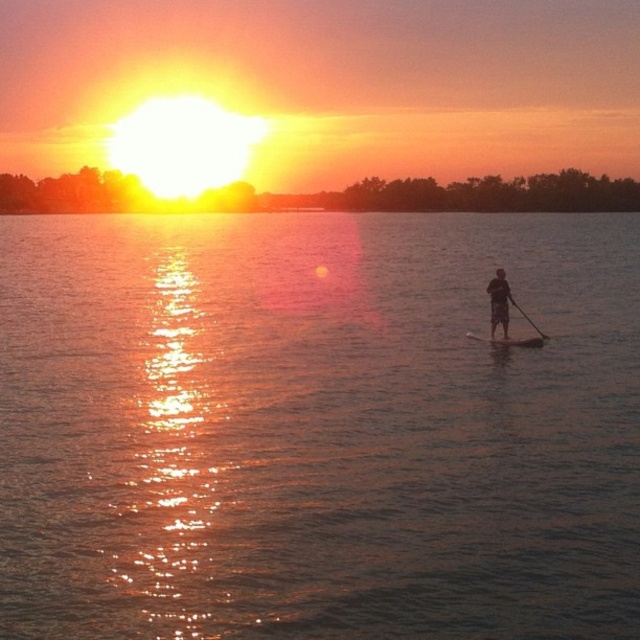
Does glistening water at center have a lesser height compared to dark gray fabric paddleboard at right?

No.

Image resolution: width=640 pixels, height=640 pixels. Find the location of `glistening water at center`. glistening water at center is located at coordinates (316, 428).

Who is more forward, (3, 282) or (493, 320)?

Point (493, 320) is more forward.

What are the coordinates of `glistening water at center` in the screenshot? It's located at (316, 428).

Between point (493, 324) and point (508, 298), which one is positioned behind?

The point (493, 324) is more distant.

Can you confirm if dark gray fabric paddleboard at right is bigger than black smooth paddle at right?

No, dark gray fabric paddleboard at right is not bigger than black smooth paddle at right.

Is point (497, 273) less distant than point (515, 301)?

Yes.

This screenshot has width=640, height=640. I want to click on dark gray fabric paddleboard at right, so click(x=499, y=301).

Describe the element at coordinates (499, 301) in the screenshot. I see `dark gray fabric paddleboard at right` at that location.

Between dark gray fabric paddleboard at right and smooth wooden paddleboard at right, which one appears on the right side from the viewer's perspective?

Positioned to the right is smooth wooden paddleboard at right.

Locate an element on the screen. The image size is (640, 640). dark gray fabric paddleboard at right is located at coordinates (499, 301).